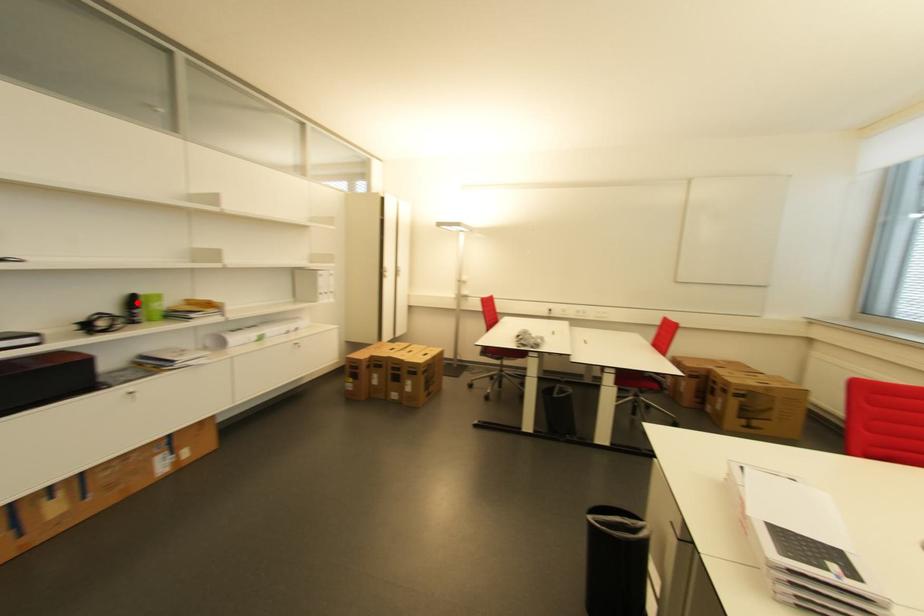
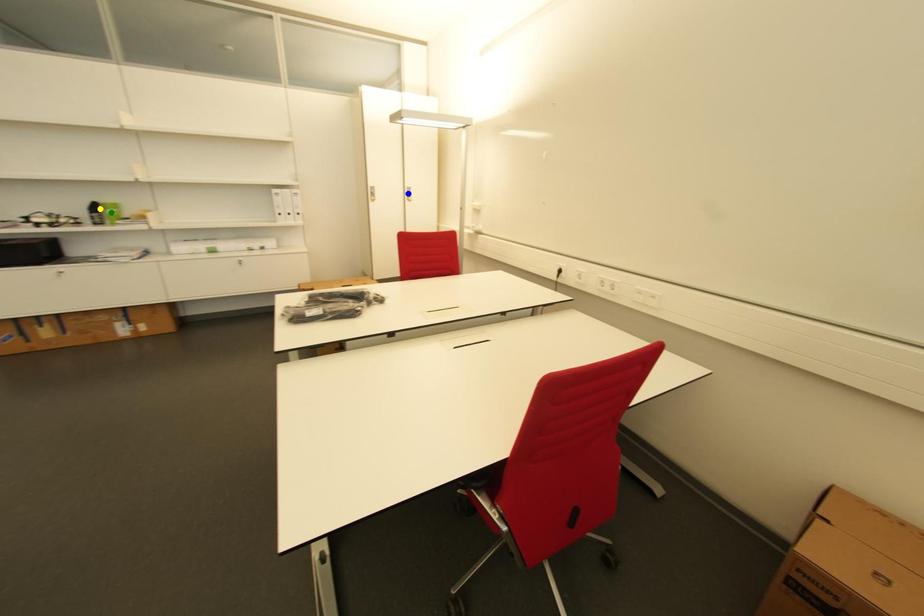
Question: I am providing you with two images of the same scene from different viewpoints. A red point is marked on the first image. You are given multiple points on the second image. Which point in image 2 is actually the same real-world point as the red point in image 1?

Choices:
 (A) yellow point
 (B) blue point
 (C) green point

Answer: (A)